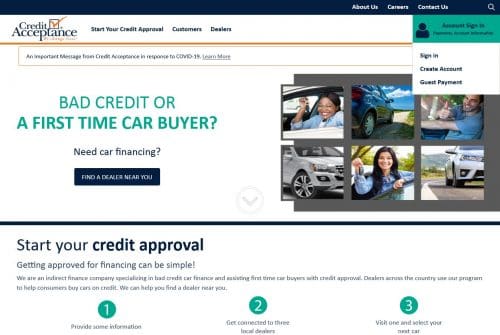
Locate an element on the screen. Image resolution: width=500 pixels, height=335 pixels. keys is located at coordinates (361, 173), (308, 103).